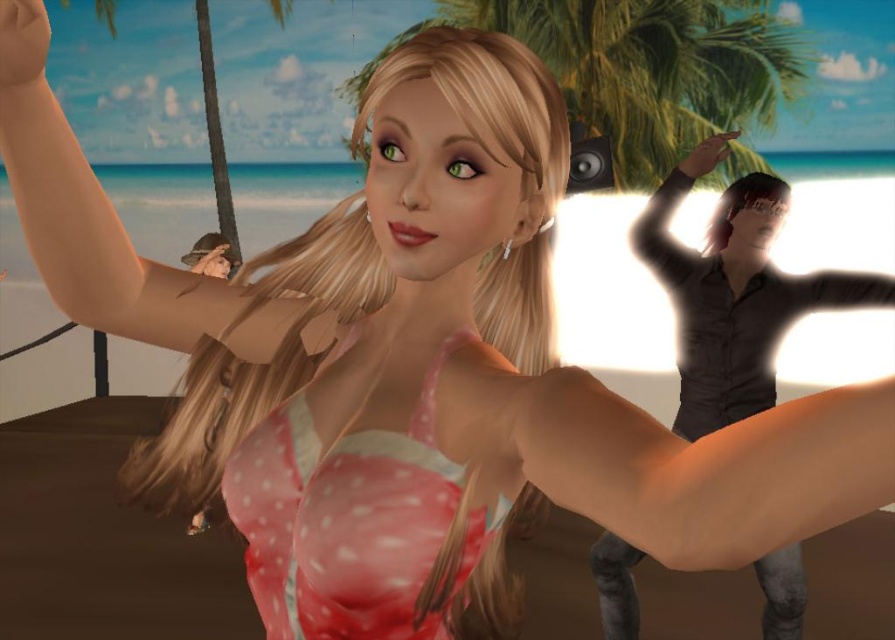
You are a photographer trying to capture the character in the pink polka dot fabric dress at center and the green leafy palm tree at upper center in the same frame. Based on their sizes, which one should you focus on first to ensure both are in focus?

The pink polka dot fabric dress at center is shorter than the green leafy palm tree at upper center, so you should focus on the green leafy palm tree at upper center first to ensure both are in focus.

You are a photographer trying to capture the perfect shot of the scene. You notice two points in the image labeled as point 1 at coordinates point (356, 476) and point 2 at coordinates point (587, 28). Which point is positioned closer to the camera?

Point (356, 476) is closer to the camera than point (587, 28).